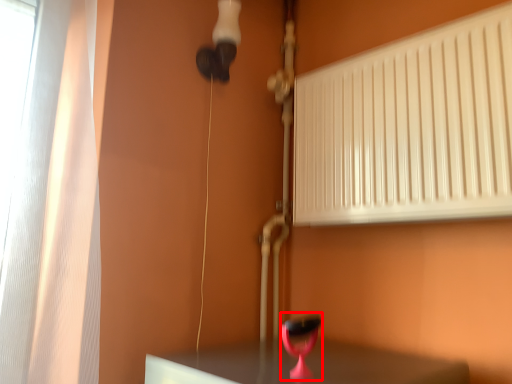
Question: From the image's perspective, considering the relative positions of table lamp (annotated by the red box) and radiator in the image provided, where is table lamp (annotated by the red box) located with respect to the staircase?

Choices:
 (A) above
 (B) below

Answer: (B)